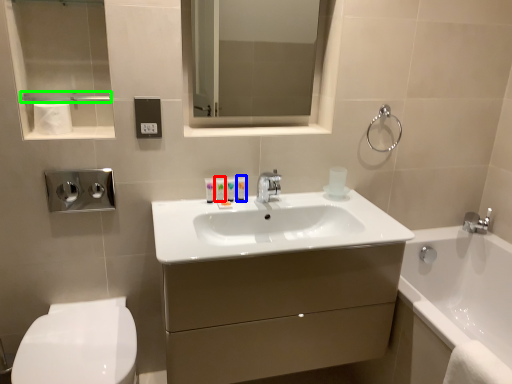
Question: Which object is positioned closest to toiletry (highlighted by a red box)? Select from toiletry (highlighted by a blue box) and balustrade (highlighted by a green box).

Choices:
 (A) toiletry
 (B) balustrade

Answer: (A)